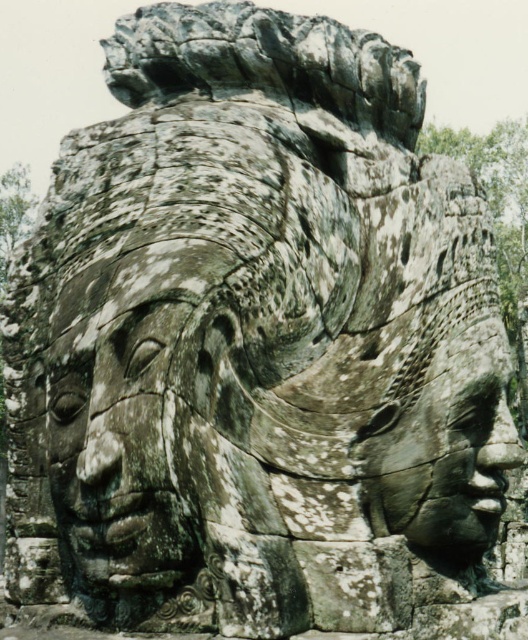
Question: Does gray stone face at center appear on the left side of rough stone face at center?

Choices:
 (A) no
 (B) yes

Answer: (B)

Question: Which of the following is the farthest from the observer?

Choices:
 (A) (491, 536)
 (B) (68, 420)

Answer: (A)

Question: Is gray stone face at center closer to camera compared to rough stone face at center?

Choices:
 (A) no
 (B) yes

Answer: (B)

Question: Is gray stone face at center positioned at the back of rough stone face at center?

Choices:
 (A) yes
 (B) no

Answer: (B)

Question: Which object is farther from the camera taking this photo?

Choices:
 (A) rough stone face at center
 (B) gray stone face at center

Answer: (A)